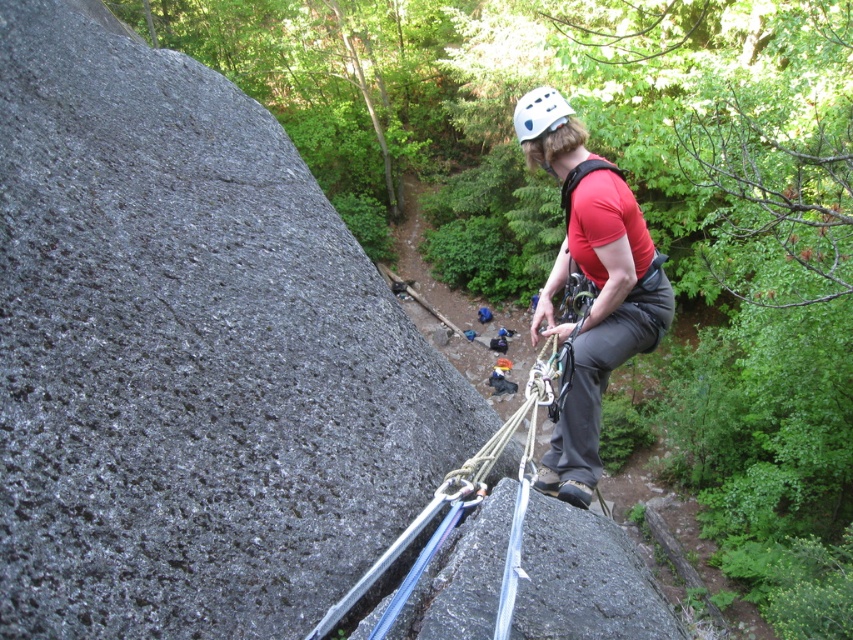
Is point (593, 154) farther from camera compared to point (556, 100)?

Yes.

The width and height of the screenshot is (853, 640). In order to click on matte red shirt at center in this screenshot , I will do `click(592, 282)`.

In order to click on matte red shirt at center in this screenshot , I will do `click(592, 282)`.

Between smooth granite rock at center and white matte helmet at upper center, which one is positioned lower?

smooth granite rock at center is below.

Who is positioned more to the right, smooth granite rock at center or white matte helmet at upper center?

From the viewer's perspective, white matte helmet at upper center appears more on the right side.

Between point (412, 452) and point (521, 125), which one is positioned behind?

Positioned behind is point (412, 452).

The image size is (853, 640). Identify the location of smooth granite rock at center. tap(189, 356).

What do you see at coordinates (189, 356) in the screenshot? Image resolution: width=853 pixels, height=640 pixels. I see `smooth granite rock at center` at bounding box center [189, 356].

This screenshot has width=853, height=640. What do you see at coordinates (189, 356) in the screenshot? I see `smooth granite rock at center` at bounding box center [189, 356].

Image resolution: width=853 pixels, height=640 pixels. I want to click on smooth granite rock at center, so click(x=189, y=356).